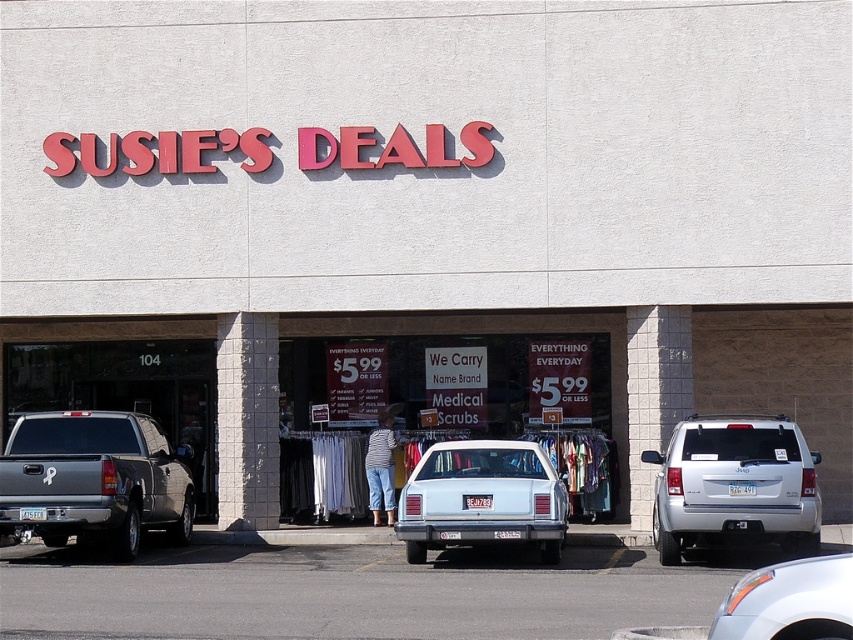
You are a delivery person trying to park your van in the gray asphalt parking lot at lower center. The van is 2 meters wide. Can you fit your van into the parking lot space if the white glossy sedan at center is currently occupying part of it?

The gray asphalt parking lot at lower center is larger in size than the white glossy sedan at center, so there might still be enough space for the van to park. However, since the sedan is occupying part of the parking lot, it is uncertain if the remaining space is sufficient for a 2 meter wide van without further information about the parking lot dimensions.